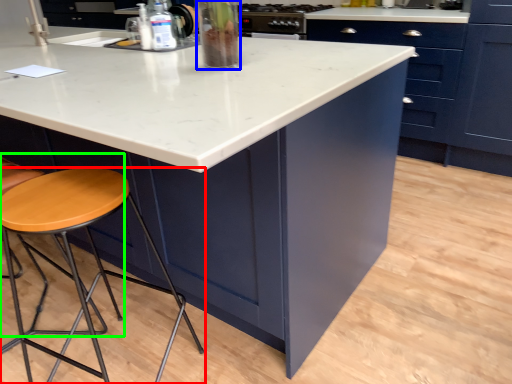
Question: Considering the real-world distances, which object is closest to stool (highlighted by a red box)? appliance (highlighted by a blue box) or chair (highlighted by a green box).

Choices:
 (A) appliance
 (B) chair

Answer: (B)